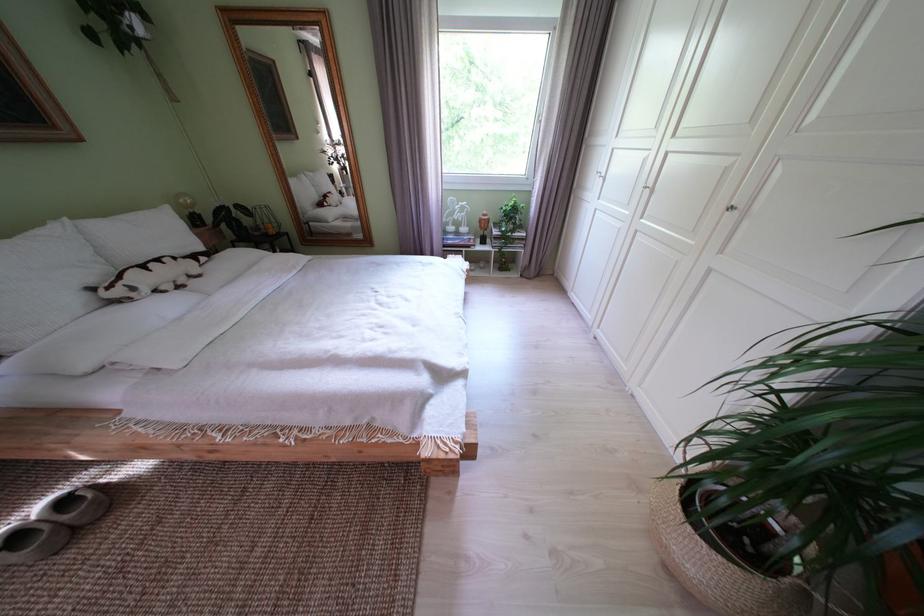
Which object does [718,564] point to?

It refers to a woven plant basket.